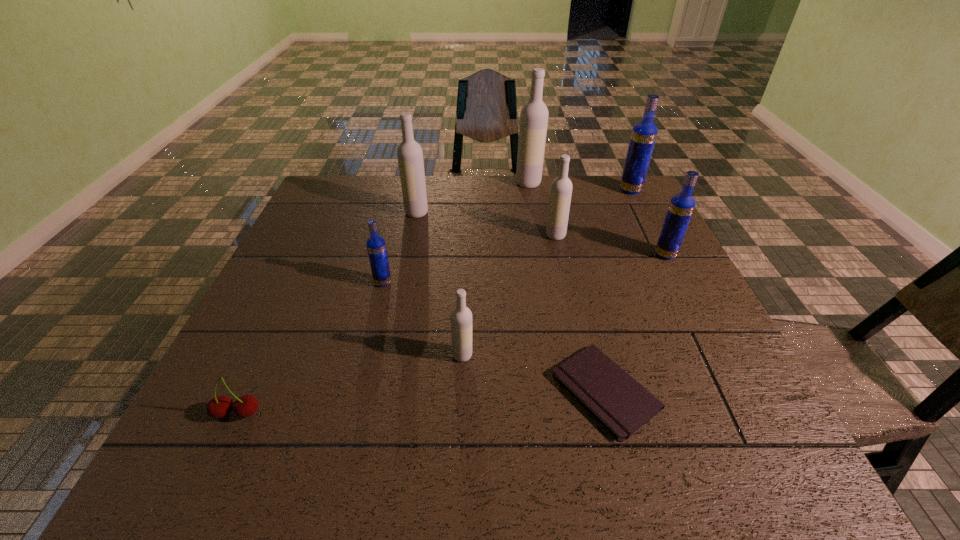
Locate an element on the screen. vacant area between the tallest vodka and the smallest blue vodka is located at coordinates (456, 233).

Identify the location of vacant space in between the third farthest white vodka and the third farthest object. This screenshot has height=540, width=960. (486, 224).

Where is `vacant point located between the fourth farthest object and the sixth object from right to left`? vacant point located between the fourth farthest object and the sixth object from right to left is located at coordinates (509, 295).

Locate an element on the screen. The image size is (960, 540). object identified as the third closest to the second smallest white vodka is located at coordinates (644, 133).

Locate an element on the screen. object that is the fifth nearest to the biggest blue vodka is located at coordinates (622, 405).

Point out which vodka is positioned as the nearest to the leftmost object. Please provide its 2D coordinates. Your answer should be formatted as a tuple, i.e. [(x, y)], where the tuple contains the x and y coordinates of a point satisfying the conditions above.

[(376, 247)]

Image resolution: width=960 pixels, height=540 pixels. I want to click on the fourth closest vodka to the shortest object, so click(376, 247).

Point out which white vodka is positioned as the nearest to the smallest blue vodka. Please provide its 2D coordinates. Your answer should be formatted as a tuple, i.e. [(x, y)], where the tuple contains the x and y coordinates of a point satisfying the conditions above.

[(461, 316)]

Locate which white vodka is the closest to the fifth nearest vodka. Please provide its 2D coordinates. Your answer should be formatted as a tuple, i.e. [(x, y)], where the tuple contains the x and y coordinates of a point satisfying the conditions above.

[(534, 115)]

Select which blue vodka is the third closest to the third farthest vodka. Please provide its 2D coordinates. Your answer should be formatted as a tuple, i.e. [(x, y)], where the tuple contains the x and y coordinates of a point satisfying the conditions above.

[(681, 206)]